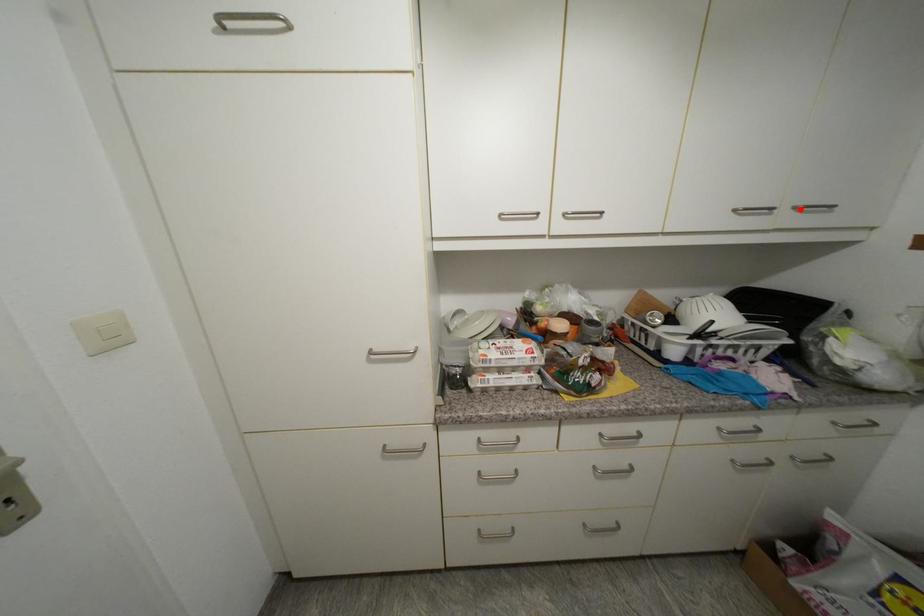
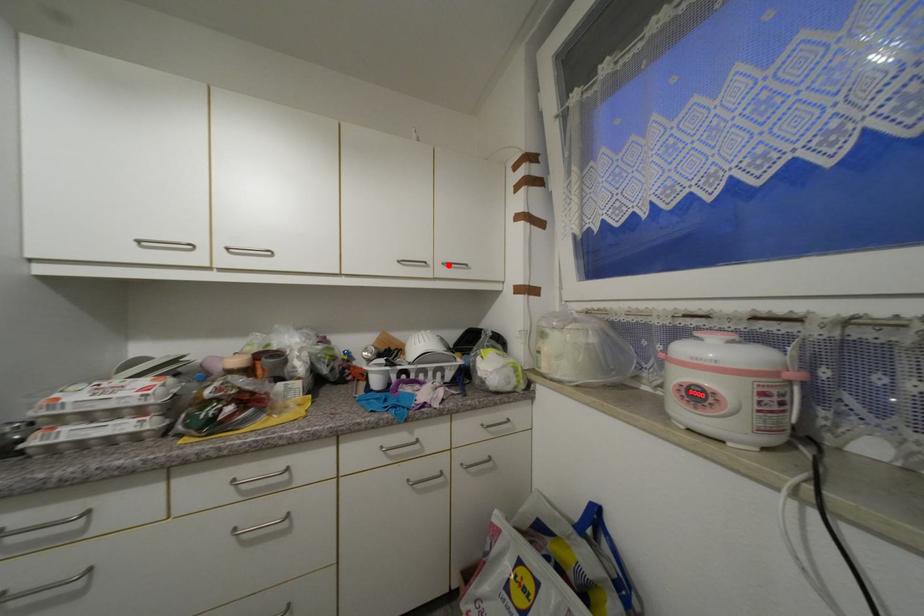
Consider the image. I am providing you with two images of the same scene from different viewpoints. A red point is marked on the first image and another point is marked on the second image. Are the points marked in image1 and image2 representing the same 3D position?

Yes